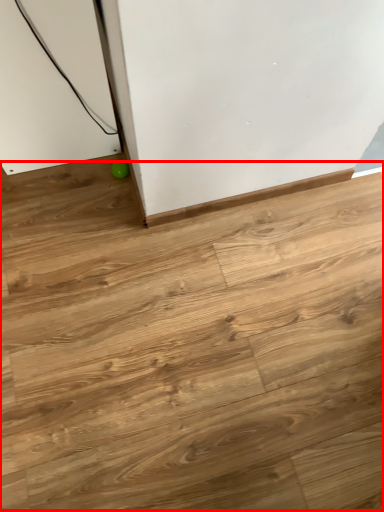
Question: From the image's perspective, where is plywood (annotated by the red box) located relative to ball?

Choices:
 (A) below
 (B) above

Answer: (A)